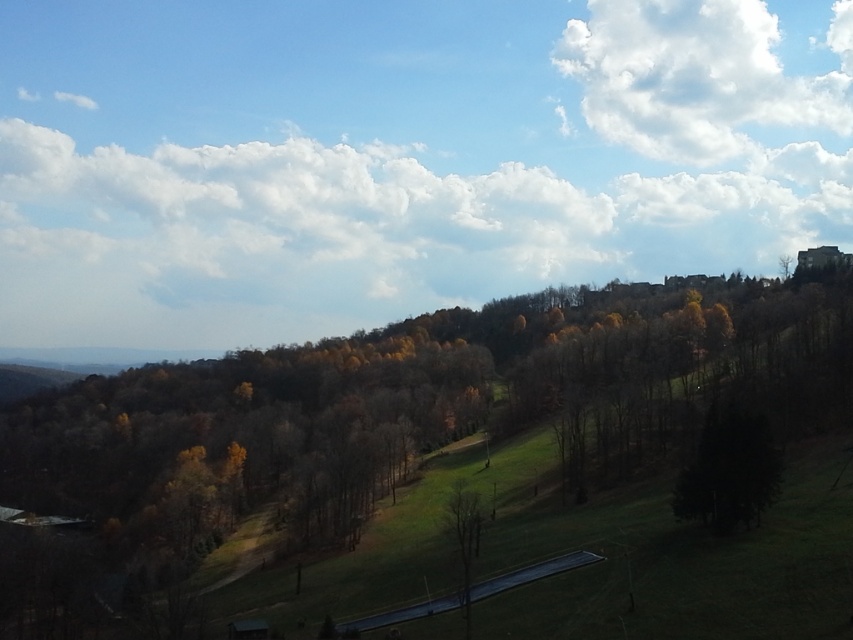
Does point (616, 28) lie in front of point (473, 586)?

That is False.

Is point (643, 1) farther from camera compared to point (463, 496)?

Yes, point (643, 1) is farther from viewer.

Which is behind, point (614, 124) or point (463, 512)?

Point (614, 124)

The width and height of the screenshot is (853, 640). Find the location of `white fluffy cloud at upper right`. white fluffy cloud at upper right is located at coordinates (697, 76).

Can you confirm if white fluffy cloud at upper right is bigger than dark green textured tree at lower right?

Yes, white fluffy cloud at upper right is bigger than dark green textured tree at lower right.

Does white fluffy cloud at upper right have a smaller size compared to dark green textured tree at lower right?

No, white fluffy cloud at upper right is not smaller than dark green textured tree at lower right.

Does point (698, 90) come closer to viewer compared to point (679, 484)?

No, it is not.

I want to click on white fluffy cloud at upper right, so click(x=697, y=76).

Can you confirm if brown matte tree at center is positioned to the right of bare wood tree at center?

Correct, you'll find brown matte tree at center to the right of bare wood tree at center.

Which of these two, brown matte tree at center or bare wood tree at center, stands shorter?

Standing shorter between the two is bare wood tree at center.

Between point (614, 435) and point (460, 566), which one is positioned in front?

Point (460, 566)

This screenshot has width=853, height=640. Identify the location of brown matte tree at center. (438, 403).